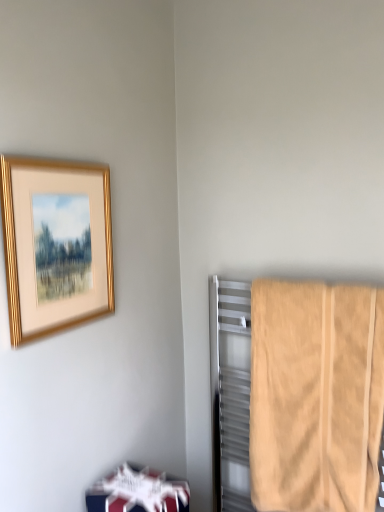
Question: Is beige cotton towel at right smaller than white glossy bookshelf at lower left?

Choices:
 (A) yes
 (B) no

Answer: (B)

Question: Is beige cotton towel at right behind white glossy bookshelf at lower left?

Choices:
 (A) yes
 (B) no

Answer: (A)

Question: Is the position of beige cotton towel at right less distant than that of white glossy bookshelf at lower left?

Choices:
 (A) no
 (B) yes

Answer: (A)

Question: Is white glossy bookshelf at lower left located within beige cotton towel at right?

Choices:
 (A) no
 (B) yes

Answer: (A)

Question: Considering the relative sizes of beige cotton towel at right and white glossy bookshelf at lower left in the image provided, is beige cotton towel at right wider than white glossy bookshelf at lower left?

Choices:
 (A) no
 (B) yes

Answer: (A)

Question: From a real-world perspective, is gold metallic picture frame at upper left physically located above or below white glossy bookshelf at lower left?

Choices:
 (A) below
 (B) above

Answer: (B)

Question: Is gold metallic picture frame at upper left bigger or smaller than white glossy bookshelf at lower left?

Choices:
 (A) small
 (B) big

Answer: (B)

Question: Is gold metallic picture frame at upper left taller or shorter than white glossy bookshelf at lower left?

Choices:
 (A) tall
 (B) short

Answer: (A)

Question: Relative to white glossy bookshelf at lower left, is gold metallic picture frame at upper left in front or behind?

Choices:
 (A) behind
 (B) front

Answer: (B)

Question: From the image's perspective, is white glossy bookshelf at lower left positioned above or below beige cotton towel at right?

Choices:
 (A) above
 (B) below

Answer: (B)

Question: Considering the positions of white glossy bookshelf at lower left and beige cotton towel at right in the image, is white glossy bookshelf at lower left taller or shorter than beige cotton towel at right?

Choices:
 (A) short
 (B) tall

Answer: (A)

Question: Based on their sizes in the image, would you say white glossy bookshelf at lower left is bigger or smaller than beige cotton towel at right?

Choices:
 (A) small
 (B) big

Answer: (A)

Question: From a real-world perspective, is white glossy bookshelf at lower left physically located above or below beige cotton towel at right?

Choices:
 (A) below
 (B) above

Answer: (A)

Question: Is beige cotton towel at right taller or shorter than white glossy bookshelf at lower left?

Choices:
 (A) tall
 (B) short

Answer: (A)

Question: Is beige cotton towel at right in front of or behind white glossy bookshelf at lower left in the image?

Choices:
 (A) behind
 (B) front

Answer: (A)